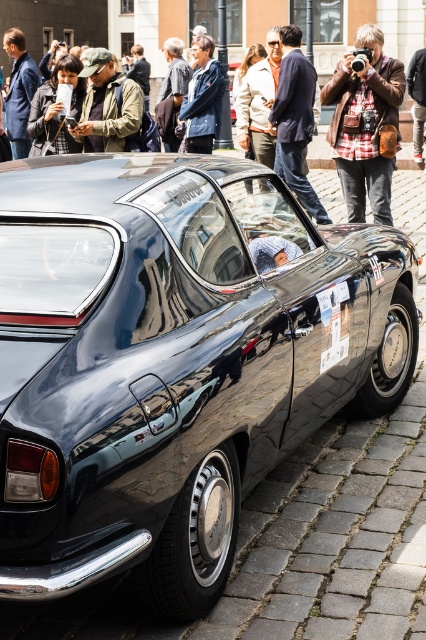
Question: Is shiny black car at center wider than matte black car at center?

Choices:
 (A) no
 (B) yes

Answer: (A)

Question: Among these objects, which one is nearest to the camera?

Choices:
 (A) matte black car at center
 (B) shiny black car at center

Answer: (B)

Question: Which point is closer to the camera?

Choices:
 (A) tap(118, 29)
 (B) tap(307, 243)

Answer: (B)

Question: Is shiny black car at center wider than matte black car at center?

Choices:
 (A) yes
 (B) no

Answer: (B)

Question: Does shiny black car at center come behind matte black car at center?

Choices:
 (A) no
 (B) yes

Answer: (A)